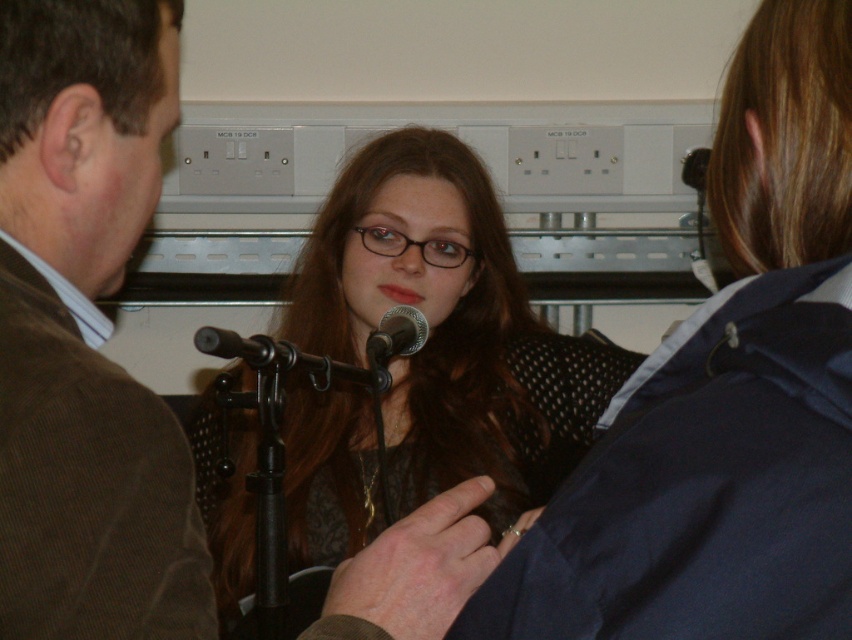
Question: Among these objects, which one is farthest from the camera?

Choices:
 (A) brown corduroy jacket at left
 (B) matte black microphone at center
 (C) metallic silver microphone at center
 (D) black metallic microphone at center

Answer: (C)

Question: Which of the following is the farthest from the observer?

Choices:
 (A) black metallic microphone at center
 (B) brown corduroy jacket at left

Answer: (A)

Question: Does brown corduroy jacket at left have a smaller size compared to metallic silver microphone at center?

Choices:
 (A) no
 (B) yes

Answer: (A)

Question: Which of the following is the closest to the observer?

Choices:
 (A) matte black microphone at center
 (B) black metallic microphone at center

Answer: (A)

Question: Is brown corduroy jacket at left positioned behind metallic silver microphone at center?

Choices:
 (A) no
 (B) yes

Answer: (A)

Question: Does brown corduroy jacket at left come in front of matte black microphone at center?

Choices:
 (A) no
 (B) yes

Answer: (B)